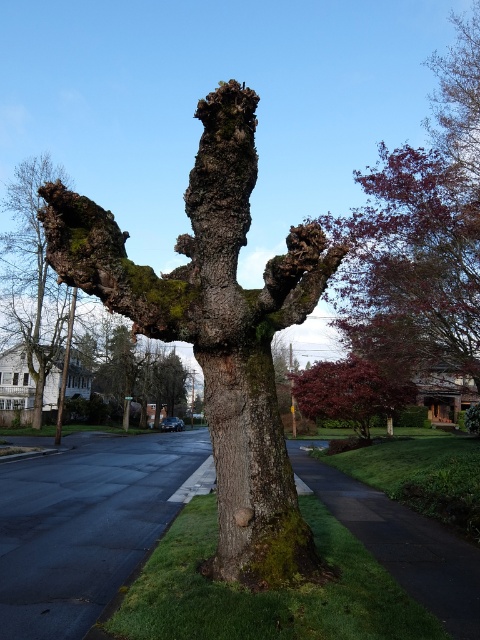
Question: Can you confirm if green mossy bark at center is wider than shiny burgundy tree at center?

Choices:
 (A) yes
 (B) no

Answer: (B)

Question: Which object is farther from the camera taking this photo?

Choices:
 (A) green mossy bark at left
 (B) green mossy bark at center
 (C) green mossy tree trunk at center
 (D) shiny burgundy tree at center

Answer: (A)

Question: Estimate the real-world distances between objects in this image. Which object is closer to the green mossy bark at left?

Choices:
 (A) shiny burgundy tree at center
 (B) green mossy bark at center

Answer: (A)

Question: Which object is positioned closest to the green mossy bark at left?

Choices:
 (A) shiny burgundy tree at center
 (B) green mossy tree trunk at center

Answer: (A)

Question: Considering the relative positions of green mossy tree trunk at center and green mossy bark at left in the image provided, where is green mossy tree trunk at center located with respect to green mossy bark at left?

Choices:
 (A) left
 (B) right

Answer: (B)

Question: Is green mossy tree trunk at center in front of green mossy bark at center?

Choices:
 (A) no
 (B) yes

Answer: (B)